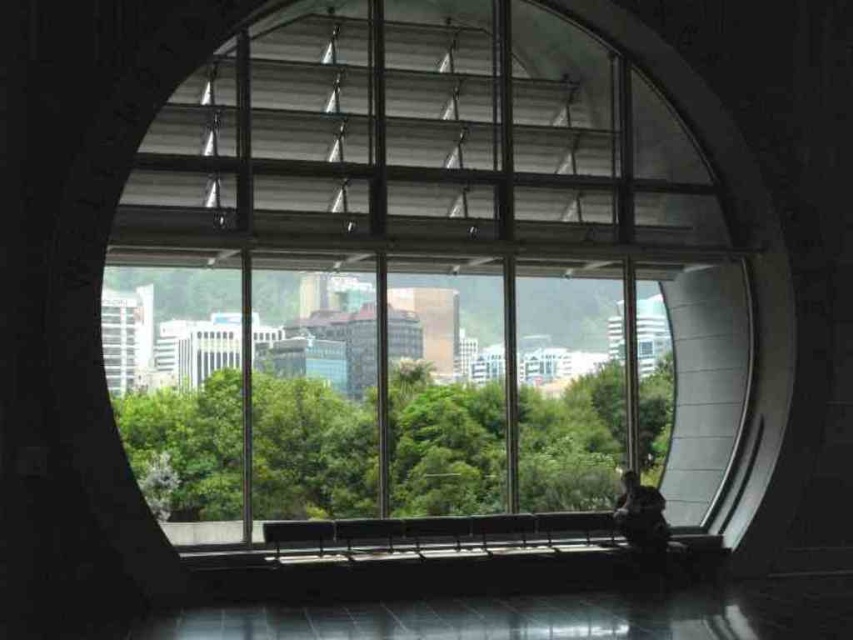
You are an architect designing a new building and want to ensure the transparent glass window at center allows a full view of the green leafy tree at center outside. Based on their sizes, will the window be tall enough to show the entire tree?

The transparent glass window at center is taller than the green leafy tree at center, so yes, the window will be tall enough to show the entire tree.

You are standing in a room with a large circular window. You notice two points marked on the window at coordinates point [192,138] and point [224,433]. If you want to clean the point that is closer to you, which coordinate should you target?

Point [192,138] is closer to the camera, so you should target point [192,138] for cleaning.